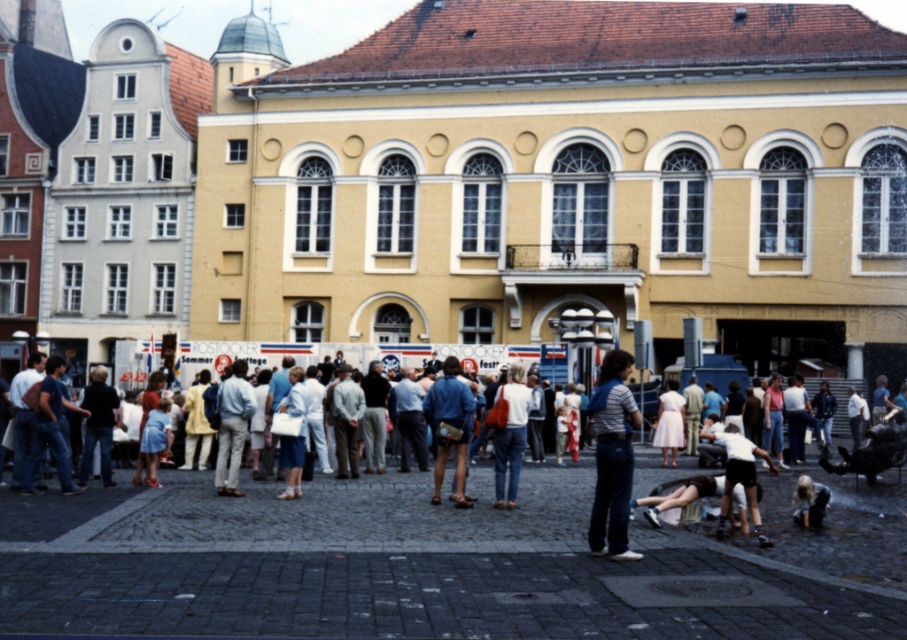
Question: Which is farther from the blonde hair person at lower right?

Choices:
 (A) matte white shirt at center
 (B) denim jacket at center
 (C) denim shorts at center
 (D) striped t-shirt at center

Answer: (C)

Question: Among these objects, which one is nearest to the camera?

Choices:
 (A) denim jacket at center
 (B) white cotton shirt at lower right

Answer: (B)

Question: Can you confirm if striped t-shirt at center is thinner than white cotton shirt at lower right?

Choices:
 (A) no
 (B) yes

Answer: (B)

Question: Which of these objects is positioned farthest from the blonde hair person at lower right?

Choices:
 (A) denim shorts at center
 (B) denim jacket at center

Answer: (A)

Question: Does matte white shirt at center lie in front of white cotton shirt at lower right?

Choices:
 (A) no
 (B) yes

Answer: (A)

Question: Does denim jacket at center appear on the right side of white cotton shirt at lower right?

Choices:
 (A) yes
 (B) no

Answer: (B)